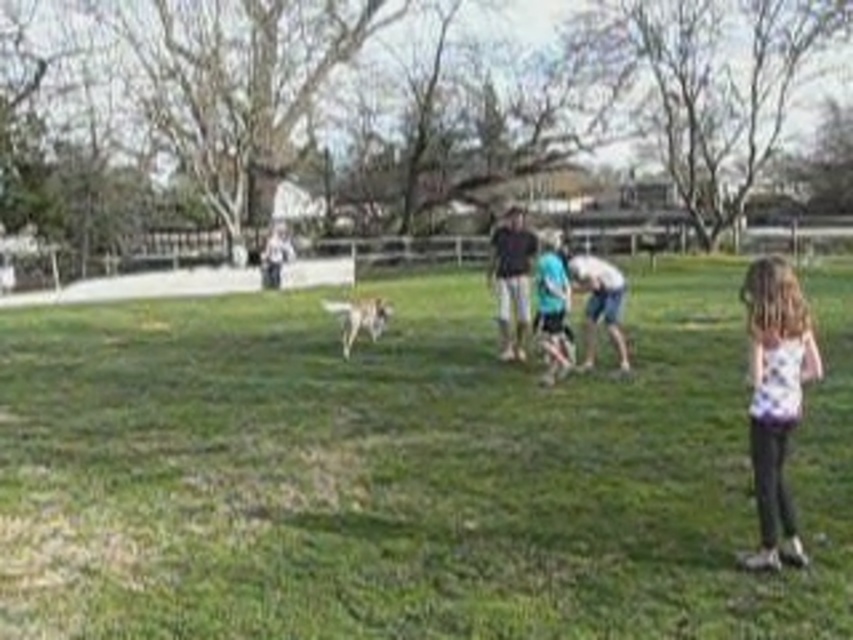
Question: Among these points, which one is nearest to the camera?

Choices:
 (A) (607, 300)
 (B) (102, 570)

Answer: (B)

Question: Can you confirm if black cotton shirt at center is bigger than white cotton shirt at center?

Choices:
 (A) yes
 (B) no

Answer: (A)

Question: Considering the relative positions of white cotton shirt at center and white fur dog at center in the image provided, where is white cotton shirt at center located with respect to white fur dog at center?

Choices:
 (A) below
 (B) above

Answer: (A)

Question: Is white printed shirt at right to the left of white cotton shirt at center from the viewer's perspective?

Choices:
 (A) no
 (B) yes

Answer: (B)

Question: Which point appears farthest from the camera in this image?

Choices:
 (A) (546, 259)
 (B) (811, 582)
 (C) (521, 266)
 (D) (347, 356)

Answer: (D)

Question: Which point is farther to the camera?

Choices:
 (A) green grassy field at center
 (B) white printed shirt at right
 (C) blue fabric shirt at center
 (D) black cotton shirt at center

Answer: (D)